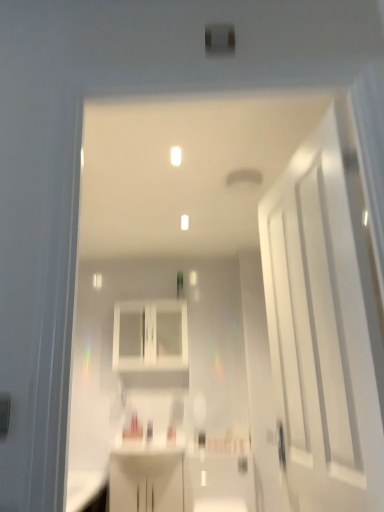
Question: Does white glossy cabinet at center appear on the left side of white glossy door at right?

Choices:
 (A) no
 (B) yes

Answer: (B)

Question: Does white glossy cabinet at center have a greater width compared to white glossy door at right?

Choices:
 (A) yes
 (B) no

Answer: (A)

Question: From the image's perspective, does white glossy cabinet at center appear lower than white glossy door at right?

Choices:
 (A) no
 (B) yes

Answer: (B)

Question: Does white glossy cabinet at center have a larger size compared to white glossy door at right?

Choices:
 (A) no
 (B) yes

Answer: (A)

Question: From the image's perspective, would you say white glossy cabinet at center is positioned over white glossy door at right?

Choices:
 (A) no
 (B) yes

Answer: (A)

Question: Considering the relative sizes of white glossy cabinet at center and white glossy door at right in the image provided, is white glossy cabinet at center shorter than white glossy door at right?

Choices:
 (A) yes
 (B) no

Answer: (A)

Question: Is white glossy door at right to the right of white glossy cabinet at center from the viewer's perspective?

Choices:
 (A) no
 (B) yes

Answer: (B)

Question: Are white glossy door at right and white glossy cabinet at center beside each other?

Choices:
 (A) yes
 (B) no

Answer: (B)

Question: Is white glossy door at right not near white glossy cabinet at center?

Choices:
 (A) yes
 (B) no

Answer: (A)

Question: Does white glossy door at right come in front of white glossy cabinet at center?

Choices:
 (A) yes
 (B) no

Answer: (A)

Question: From the image's perspective, is white glossy door at right below white glossy cabinet at center?

Choices:
 (A) no
 (B) yes

Answer: (A)

Question: Can you confirm if white glossy door at right is thinner than white glossy cabinet at center?

Choices:
 (A) yes
 (B) no

Answer: (A)

Question: From a real-world perspective, is white glossy door at right physically located above or below white glossy cabinet at center?

Choices:
 (A) below
 (B) above

Answer: (A)